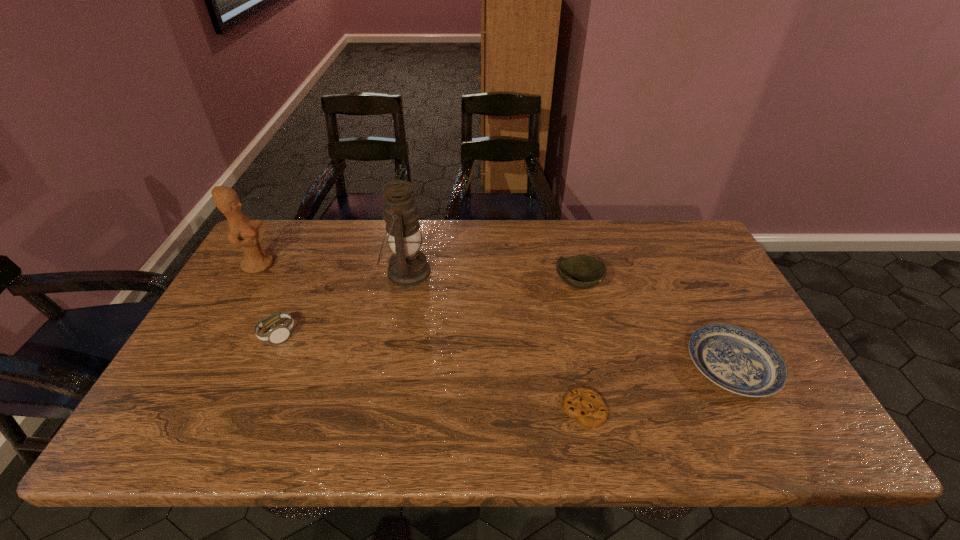
This screenshot has width=960, height=540. I want to click on free space that satisfies the following two spatial constraints: 1. on the front-facing side of the bowl; 2. on the left side of the figurine, so click(x=248, y=284).

Image resolution: width=960 pixels, height=540 pixels. Find the location of `blank space that satisfies the following two spatial constraints: 1. on the front-facing side of the leftmost object; 2. on the left side of the plate`. blank space that satisfies the following two spatial constraints: 1. on the front-facing side of the leftmost object; 2. on the left side of the plate is located at coordinates (201, 366).

Where is `free space in the image that satisfies the following two spatial constraints: 1. on the back side of the oil lamp; 2. on the front-facing side of the leftmost object`? free space in the image that satisfies the following two spatial constraints: 1. on the back side of the oil lamp; 2. on the front-facing side of the leftmost object is located at coordinates (408, 265).